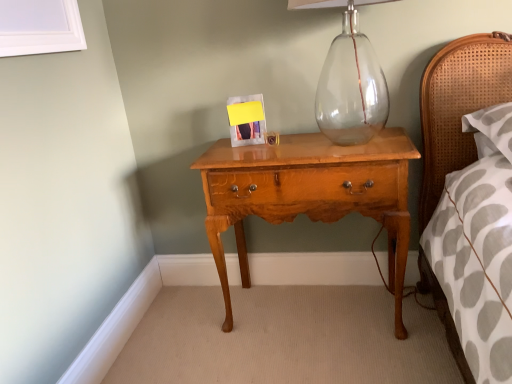
Question: Is light brown wood nightstand at center taller or shorter than yellow paper at center?

Choices:
 (A) tall
 (B) short

Answer: (A)

Question: Is light brown wood nightstand at center in front of or behind yellow paper at center in the image?

Choices:
 (A) behind
 (B) front

Answer: (B)

Question: Is light brown wood nightstand at center wider or thinner than yellow paper at center?

Choices:
 (A) wide
 (B) thin

Answer: (A)

Question: Is point (239, 99) positioned closer to the camera than point (330, 198)?

Choices:
 (A) farther
 (B) closer

Answer: (A)

Question: From a real-world perspective, is yellow paper at center physically located above or below light brown wood nightstand at center?

Choices:
 (A) below
 (B) above

Answer: (B)

Question: Is yellow paper at center to the left or to the right of light brown wood nightstand at center in the image?

Choices:
 (A) right
 (B) left

Answer: (B)

Question: Based on their sizes in the image, would you say yellow paper at center is bigger or smaller than light brown wood nightstand at center?

Choices:
 (A) small
 (B) big

Answer: (A)